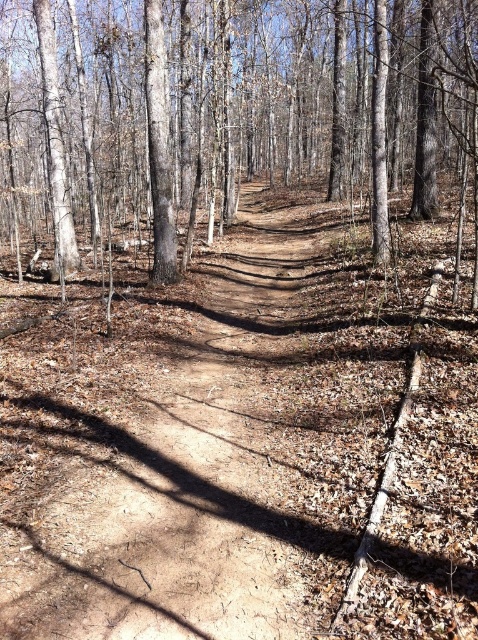
Question: Can you confirm if brown dirt track at center is positioned below brown smooth tree at center?

Choices:
 (A) yes
 (B) no

Answer: (A)

Question: Among these points, which one is nearest to the camera?

Choices:
 (A) (186, 19)
 (B) (2, 532)

Answer: (B)

Question: Is brown dirt track at center further to camera compared to brown smooth tree at center?

Choices:
 (A) no
 (B) yes

Answer: (A)

Question: Can you confirm if brown dirt track at center is thinner than brown smooth tree at center?

Choices:
 (A) yes
 (B) no

Answer: (A)

Question: Which point is closer to the camera?

Choices:
 (A) brown dirt track at center
 (B) brown smooth tree at center

Answer: (A)

Question: Which point appears farthest from the camera in this image?

Choices:
 (A) (308, 102)
 (B) (294, 371)

Answer: (A)